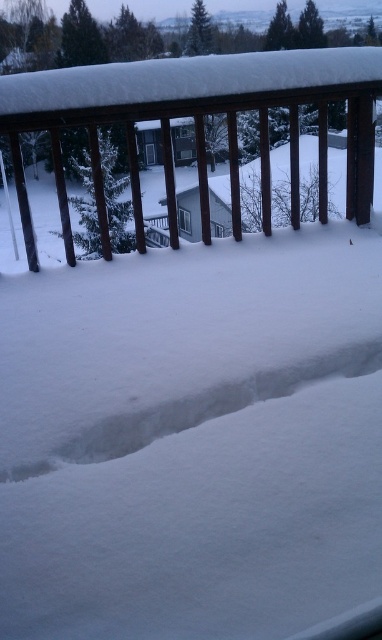
You are standing on the balcony and want to place a 4 feet long snow sculpture between the wooden railing at upper center and the white snow at lower center. Is there enough space?

The wooden railing at upper center is 3.89 feet away from the white snow at lower center. Since the snow sculpture is 4 feet long, it won not fit between them as the distance is shorter than the sculpture.

You are standing on the balcony and want to place a rectangular wooden board that is 1.2 meters wide between the wooden railing at upper center and the white snow at lower center. Can the board fit horizontally without overlapping either object?

The wooden railing at upper center might be wider than white snow at lower center, so the board might not fit horizontally between them without overlapping since the width of the railing and snow are uncertain.